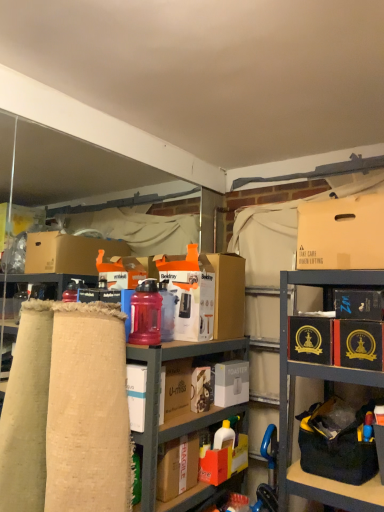
What is the approximate width of matte cardboard boxes at center, marked as the 1th cabinetry in a top-to-bottom arrangement?

The width of matte cardboard boxes at center, marked as the 1th cabinetry in a top-to-bottom arrangement, is 2.75 inches.

This screenshot has height=512, width=384. What do you see at coordinates (227, 293) in the screenshot? I see `white cardboard box at center` at bounding box center [227, 293].

Describe the element at coordinates (224, 437) in the screenshot. I see `translucent plastic bottle at center` at that location.

Find the location of `white cardboard box at center, positioned as the 6th box in bottom-to-top order`. white cardboard box at center, positioned as the 6th box in bottom-to-top order is located at coordinates (190, 293).

The image size is (384, 512). I want to click on black cardboard box at upper right, placed as the 3th box when sorted from top to bottom, so click(x=359, y=304).

In order to face black cardboard box at center-right, placed as the fifth box when sorted from top to bottom, should I rotate leftwards or rightwards?

It's best to rotate right around 18.145 degrees.

Locate an element on the screen. matte cardboard boxes at center, arranged as the 2th cabinetry when ordered from the bottom is located at coordinates (25, 423).

Based on the photo, considering the sizes of white cardboard box at center, the 6th box from the top, and matte cardboard boxes at center, arranged as the 2th cabinetry when ordered from the bottom, in the image, is white cardboard box at center, the 6th box from the top, taller or shorter than matte cardboard boxes at center, arranged as the 2th cabinetry when ordered from the bottom,?

Considering their sizes, white cardboard box at center, the 6th box from the top, has less height than matte cardboard boxes at center, arranged as the 2th cabinetry when ordered from the bottom.

Is white cardboard box at center, the 6th box from the top, behind matte cardboard boxes at center, arranged as the 2th cabinetry when ordered from the bottom?

Yes, white cardboard box at center, the 6th box from the top, is behind matte cardboard boxes at center, arranged as the 2th cabinetry when ordered from the bottom.

From the image's perspective, does white cardboard box at center, the 6th box from the top, appear lower than matte cardboard boxes at center, marked as the 1th cabinetry in a top-to-bottom arrangement?

Yes, from the image's perspective, white cardboard box at center, the 6th box from the top, is below matte cardboard boxes at center, marked as the 1th cabinetry in a top-to-bottom arrangement.

From a real-world perspective, which is physically below, white cardboard box at center, the 6th box from the top, or matte cardboard boxes at center, marked as the 1th cabinetry in a top-to-bottom arrangement?

white cardboard box at center, the 6th box from the top, is physically lower.

Does point (168, 426) come in front of point (227, 421)?

That is True.

Identify the location of cleaning product above the matte cardboard boxes at center, the first cabinetry positioned from the bottom (from a real-world perspective). Image resolution: width=384 pixels, height=512 pixels. (224, 437).

From the image's perspective, is matte cardboard boxes at center, the first cabinetry positioned from the bottom, located beneath translucent plastic bottle at center?

No.

Which object is closer to the camera, translucent plastic bottle at center or black cardboard box at center-right, placed as the fifth box when sorted from top to bottom?

black cardboard box at center-right, placed as the fifth box when sorted from top to bottom, is more forward.

Which of these two, translucent plastic bottle at center or black cardboard box at center-right, placed as the fifth box when sorted from top to bottom, is smaller?

translucent plastic bottle at center.

Are translucent plastic bottle at center and black cardboard box at center-right, placed as the fifth box when sorted from top to bottom, located far from each other?

Actually, translucent plastic bottle at center and black cardboard box at center-right, placed as the fifth box when sorted from top to bottom, are a little close together.

Could you tell me if translucent plastic bottle at center is turned towards black cardboard box at center-right, placed as the fifth box when sorted from top to bottom?

No, translucent plastic bottle at center is not turned towards black cardboard box at center-right, placed as the fifth box when sorted from top to bottom.

Is black cardboard box at upper right, which ranks as the fifth box in bottom-to-top order, oriented towards black cardboard box at center-right, placed as the fifth box when sorted from top to bottom?

No.

Considering the positions of points (373, 320) and (321, 318), is point (373, 320) closer to camera compared to point (321, 318)?

Yes, point (373, 320) is closer to viewer.

From the image's perspective, is black cardboard box at upper right, which ranks as the fifth box in bottom-to-top order, over black cardboard box at center-right, marked as the 3th box in a bottom-to-top arrangement?

Yes, from the image's perspective, black cardboard box at upper right, which ranks as the fifth box in bottom-to-top order, is above black cardboard box at center-right, marked as the 3th box in a bottom-to-top arrangement.

From the image's perspective, which is above, white cardboard box at center or matte cardboard boxes at center, arranged as the 2th cabinetry when ordered from the bottom?

white cardboard box at center, from the image's perspective.

From a real-world perspective, is white cardboard box at center under matte cardboard boxes at center, arranged as the 2th cabinetry when ordered from the bottom?

No, from a real-world perspective, white cardboard box at center is not beneath matte cardboard boxes at center, arranged as the 2th cabinetry when ordered from the bottom.

How different are the orientations of white cardboard box at center and matte cardboard boxes at center, arranged as the 2th cabinetry when ordered from the bottom, in degrees?

0.381 degrees separate the facing orientations of white cardboard box at center and matte cardboard boxes at center, arranged as the 2th cabinetry when ordered from the bottom.

Is matte cardboard boxes at center, arranged as the 2th cabinetry when ordered from the bottom, completely or partially inside white cardboard box at center?

That's incorrect, matte cardboard boxes at center, arranged as the 2th cabinetry when ordered from the bottom, is not inside white cardboard box at center.

Which is in front, black cardboard box at right, positioned as the 4th box in bottom-to-top order, or burlap fabric at left?

burlap fabric at left.

Which is more to the right, black cardboard box at right, the 4th box positioned from the top, or burlap fabric at left?

black cardboard box at right, the 4th box positioned from the top.

Are black cardboard box at right, positioned as the 4th box in bottom-to-top order, and burlap fabric at left beside each other?

No.

Can you confirm if black cardboard box at right, the 4th box positioned from the top, is smaller than burlap fabric at left?

Yes, black cardboard box at right, the 4th box positioned from the top, is smaller than burlap fabric at left.

Is black cardboard box at center-right, marked as the 3th box in a bottom-to-top arrangement, placed right next to matte cardboard boxes at center, which is the 2th cabinetry in top-to-bottom order?

No.

Considering the points (318, 341) and (191, 345), which point is in front, point (318, 341) or point (191, 345)?

The point (318, 341) is closer to the camera.

From the matte cardboard boxes at center, which is the 2th cabinetry in top-to-bottom order, count 3rd box to the right and point to it. Please provide its 2D coordinates.

[(310, 339)]

Considering the positions of objects black cardboard box at center-right, placed as the fifth box when sorted from top to bottom, and matte cardboard boxes at center, which is the 2th cabinetry in top-to-bottom order, in the image provided, who is more to the right, black cardboard box at center-right, placed as the fifth box when sorted from top to bottom, or matte cardboard boxes at center, which is the 2th cabinetry in top-to-bottom order,?

Positioned to the right is black cardboard box at center-right, placed as the fifth box when sorted from top to bottom.

The image size is (384, 512). In the image, there is a white cardboard box at center, positioned as the second box in bottom-to-top order. Identify the location of cabinetry above it (from the image's perspective). (25, 423).

Starting from the translucent plastic bottle at center, which cabinetry is the 1st one in front? Please provide its 2D coordinates.

[(177, 413)]

Which object lies further to the anchor point white cardboard box at center, positioned as the 6th box in bottom-to-top order, black cardboard box at center-right, placed as the fifth box when sorted from top to bottom, or translucent plastic water bottle at center?

Among the two, black cardboard box at center-right, placed as the fifth box when sorted from top to bottom, is located further to white cardboard box at center, positioned as the 6th box in bottom-to-top order.

Which object lies nearer to the anchor point black fabric bag at lower right, black cardboard box at right, positioned as the 4th box in bottom-to-top order, or white plastic toaster at center, placed as the first box when sorted from bottom to top?

The object closer to black fabric bag at lower right is black cardboard box at right, positioned as the 4th box in bottom-to-top order.

In the scene shown: Considering their positions, is white cardboard box at center positioned further to black fabric bag at lower right than translucent plastic bottle at center?

white cardboard box at center is further to black fabric bag at lower right.

Based on their spatial positions, is black fabric bag at lower right or black cardboard box at upper right, placed as the 3th box when sorted from top to bottom, closer to white plastic toaster at center, positioned as the seventh box in top-to-bottom order?

Among the two, black fabric bag at lower right is located nearer to white plastic toaster at center, positioned as the seventh box in top-to-bottom order.

From the image, which object appears to be farther from white cardboard box at center, black cardboard box at right, positioned as the 4th box in bottom-to-top order, or white cardboard box at center, the 6th box from the top?

black cardboard box at right, positioned as the 4th box in bottom-to-top order.

Based on their spatial positions, is black fabric bag at lower right or matte cardboard boxes at center, marked as the 1th cabinetry in a top-to-bottom arrangement, closer to white cardboard box at center?

Among the two, black fabric bag at lower right is located nearer to white cardboard box at center.

Based on their spatial positions, is black cardboard box at upper right, placed as the 3th box when sorted from top to bottom, or black cardboard box at center-right, marked as the 3th box in a bottom-to-top arrangement, closer to black fabric bag at lower right?

The object closer to black fabric bag at lower right is black cardboard box at center-right, marked as the 3th box in a bottom-to-top arrangement.

Considering their positions, is white cardboard box at center, positioned as the 6th box in bottom-to-top order, positioned closer to matte cardboard boxes at center, marked as the 1th cabinetry in a top-to-bottom arrangement, than white plastic toaster at center, placed as the first box when sorted from bottom to top?

white cardboard box at center, positioned as the 6th box in bottom-to-top order, lies closer to matte cardboard boxes at center, marked as the 1th cabinetry in a top-to-bottom arrangement, than the other object.

Image resolution: width=384 pixels, height=512 pixels. What are the coordinates of `bottle positioned between matte cardboard boxes at center, arranged as the 2th cabinetry when ordered from the bottom, and white cardboard box at center, positioned as the 6th box in bottom-to-top order, from near to far` in the screenshot? It's located at (146, 314).

The width and height of the screenshot is (384, 512). Identify the location of handbag between black cardboard box at center-right, placed as the fifth box when sorted from top to bottom, and translucent plastic bottle at center, in the vertical direction. (337, 442).

This screenshot has height=512, width=384. Identify the location of cardboard box that lies between white cardboard box at center, positioned as the 6th box in bottom-to-top order, and white cardboard box at center, positioned as the second box in bottom-to-top order, from top to bottom. (227, 293).

Identify the location of cardboard box between matte cardboard boxes at center, arranged as the 2th cabinetry when ordered from the bottom, and black cardboard box at right, positioned as the 4th box in bottom-to-top order, in the horizontal direction. Image resolution: width=384 pixels, height=512 pixels. (227, 293).